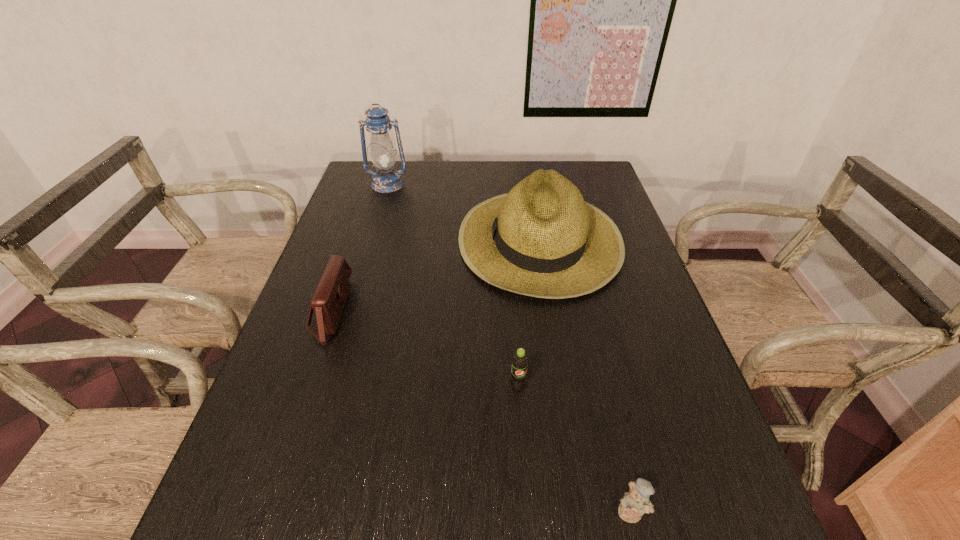
What are the coordinates of `free area in between the shoulder bag and the nearest object` in the screenshot? It's located at (481, 411).

Find the location of `free space between the teddy bear and the shoulder bag`. free space between the teddy bear and the shoulder bag is located at coordinates (481, 411).

Identify the location of vacant area between the second tallest object and the fourth farthest object. (529, 313).

Image resolution: width=960 pixels, height=540 pixels. Identify the location of vacant point located between the tallest object and the sunhat. (464, 212).

Find the location of a particular element. free space between the shortest object and the soda is located at coordinates (575, 450).

Where is `free spot between the tallest object and the sunhat`? The height and width of the screenshot is (540, 960). free spot between the tallest object and the sunhat is located at coordinates (464, 212).

Find the location of a particular element. The image size is (960, 540). free space between the lantern and the shoulder bag is located at coordinates (359, 248).

In order to click on vacant area between the second tallest object and the lantern in this screenshot , I will do `click(464, 212)`.

At what (x,y) coordinates should I click in order to perform the action: click on vacant area that lies between the nearest object and the sunhat. Please return your answer as a coordinate pair (x, y). The image size is (960, 540). Looking at the image, I should click on (586, 375).

Where is `blank region between the shoulder bag and the sunhat`? The image size is (960, 540). blank region between the shoulder bag and the sunhat is located at coordinates (x=435, y=275).